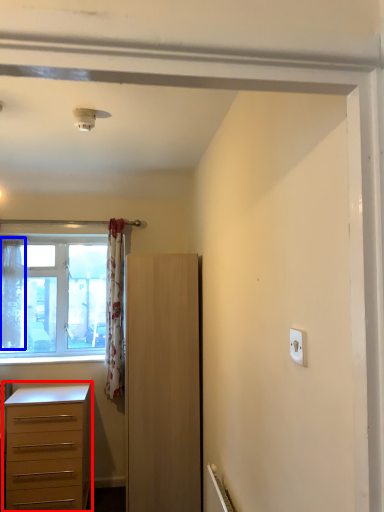
Question: Which of the following is the closest to the observer, chest of drawers (highlighted by a red box) or curtain (highlighted by a blue box)?

Choices:
 (A) chest of drawers
 (B) curtain

Answer: (A)